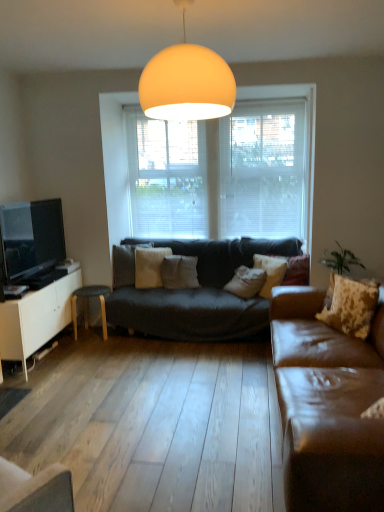
In order to click on matte black tv at left in this screenshot , I will do click(32, 238).

Measure the distance between matte black tv at left and camera.

The depth of matte black tv at left is 3.74 meters.

This screenshot has width=384, height=512. Describe the element at coordinates (36, 318) in the screenshot. I see `white matte cabinet at left` at that location.

In order to face brown leather couch at right, should I rotate leftwards or rightwards?

Turn right approximately 21.064 degrees to face it.

What is the approximate height of brown leather couch at right?

brown leather couch at right is 29.84 inches tall.

What do you see at coordinates (179, 272) in the screenshot? I see `white cotton pillow at center, which is the 3th pillow in right-to-left order` at bounding box center [179, 272].

Locate an element on the screen. This screenshot has width=384, height=512. matte black tv at left is located at coordinates pyautogui.click(x=32, y=238).

Considering the positions of objects white textured pillow at center, placed as the 2th pillow when sorted from front to back, and matte orange globe at upper center in the image provided, who is more to the right, white textured pillow at center, placed as the 2th pillow when sorted from front to back, or matte orange globe at upper center?

Positioned to the right is white textured pillow at center, placed as the 2th pillow when sorted from front to back.

Considering the sizes of white textured pillow at center, the 3th pillow from the back, and matte orange globe at upper center in the image, is white textured pillow at center, the 3th pillow from the back, wider or thinner than matte orange globe at upper center?

Clearly, white textured pillow at center, the 3th pillow from the back, has less width compared to matte orange globe at upper center.

Is white textured pillow at center, placed as the 2th pillow when sorted from front to back, surrounding matte orange globe at upper center?

No.

Is white textured pillow at center, the 3th pillow in the left-to-right sequence, bigger than matte orange globe at upper center?

No.

Does white cotton pillow at center, which is the first pillow in back-to-front order, have a larger size compared to brown leather couch at right?

No, white cotton pillow at center, which is the first pillow in back-to-front order, is not bigger than brown leather couch at right.

In the scene shown: From the image's perspective, is white cotton pillow at center, arranged as the second pillow when viewed from the left, positioned above or below brown leather couch at right?

Clearly, from the image's perspective, white cotton pillow at center, arranged as the second pillow when viewed from the left, is above brown leather couch at right.

From the picture: Is white cotton pillow at center, which is the first pillow in back-to-front order, inside the boundaries of brown leather couch at right, or outside?

white cotton pillow at center, which is the first pillow in back-to-front order, lies outside brown leather couch at right.

Which is more to the left, white cotton pillow at center, which is the first pillow in back-to-front order, or brown leather couch at right?

white cotton pillow at center, which is the first pillow in back-to-front order, is more to the left.

You are a GUI agent. You are given a task and a screenshot of the screen. Output one action in this format:
    pyautogui.click(x=<x>, y=<y>)
    Task: Click on the television located on the left of white soft pillow at center, which appears as the 2th pillow when viewed from the back
    This screenshot has width=384, height=512.
    Given the screenshot: What is the action you would take?
    pyautogui.click(x=32, y=238)

Does point (146, 283) appear closer or farther from the camera than point (56, 216)?

Point (146, 283).

Is white soft pillow at center, which is the fourth pillow from right to left, spatially inside matte black tv at left, or outside of it?

The correct answer is: outside.

Is the depth of fluffy beige pillow at right, which ranks as the 4th pillow in back-to-front order, less than that of white matte window screen at center, the first window screen when ordered from right to left?

Yes.

Considering the positions of objects fluffy beige pillow at right, which appears as the fourth pillow when viewed from the left, and white matte window screen at center, positioned as the second window screen in left-to-right order, in the image provided, who is more to the right, fluffy beige pillow at right, which appears as the fourth pillow when viewed from the left, or white matte window screen at center, positioned as the second window screen in left-to-right order,?

From the viewer's perspective, fluffy beige pillow at right, which appears as the fourth pillow when viewed from the left, appears more on the right side.

Could you tell me if fluffy beige pillow at right, the 1th pillow viewed from the front, is facing white matte window screen at center, positioned as the second window screen in left-to-right order?

No, fluffy beige pillow at right, the 1th pillow viewed from the front, is not facing towards white matte window screen at center, positioned as the second window screen in left-to-right order.

Considering the positions of points (364, 336) and (296, 103), is point (364, 336) closer to camera compared to point (296, 103)?

Yes, it is in front of point (296, 103).

Image resolution: width=384 pixels, height=512 pixels. Identify the location of television lying below the white matte window screen at center, positioned as the second window screen in left-to-right order (from the image's perspective). click(x=32, y=238).

Is matte black tv at left far from white matte window screen at center, positioned as the second window screen in left-to-right order?

matte black tv at left is positioned a significant distance from white matte window screen at center, positioned as the second window screen in left-to-right order.

Is matte black tv at left located outside white matte window screen at center, positioned as the second window screen in left-to-right order?

Yes, matte black tv at left is outside of white matte window screen at center, positioned as the second window screen in left-to-right order.

Looking at their sizes, would you say matte black tv at left is wider or thinner than white matte window screen at center, the first window screen when ordered from right to left?

In the image, matte black tv at left appears to be wider than white matte window screen at center, the first window screen when ordered from right to left.

How far apart are white cotton pillow at center, which is the first pillow in back-to-front order, and matte orange globe at upper center?

white cotton pillow at center, which is the first pillow in back-to-front order, and matte orange globe at upper center are 2.14 meters apart.

Is white cotton pillow at center, arranged as the second pillow when viewed from the left, turned away from matte orange globe at upper center?

No, white cotton pillow at center, arranged as the second pillow when viewed from the left, is not facing the opposite direction of matte orange globe at upper center.

Where is `lamp on the right of the white cotton pillow at center, arranged as the second pillow when viewed from the left`? lamp on the right of the white cotton pillow at center, arranged as the second pillow when viewed from the left is located at coordinates (186, 82).

Choose the correct answer: Is white cotton pillow at center, placed as the 4th pillow when sorted from front to back, inside matte orange globe at upper center or outside it?

white cotton pillow at center, placed as the 4th pillow when sorted from front to back, is not inside matte orange globe at upper center, it's outside.

Based on the photo, measure the distance between white cotton pillow at center, arranged as the second pillow when viewed from the left, and white matte cabinet at left.

A distance of 4.13 feet exists between white cotton pillow at center, arranged as the second pillow when viewed from the left, and white matte cabinet at left.

Is white cotton pillow at center, which is the first pillow in back-to-front order, oriented towards white matte cabinet at left?

No.

Considering the positions of objects white cotton pillow at center, placed as the 4th pillow when sorted from front to back, and white matte cabinet at left in the image provided, who is more to the left, white cotton pillow at center, placed as the 4th pillow when sorted from front to back, or white matte cabinet at left?

white matte cabinet at left.

How different are the orientations of white cotton pillow at center, placed as the 4th pillow when sorted from front to back, and white matte cabinet at left in degrees?

white cotton pillow at center, placed as the 4th pillow when sorted from front to back, and white matte cabinet at left are facing 73.7 degrees away from each other.

Find the location of a particular element. lamp that is above the white textured pillow at center, the 3th pillow in the left-to-right sequence (from a real-world perspective) is located at coordinates (186, 82).

I want to click on studio couch in front of the white cotton pillow at center, arranged as the second pillow when viewed from the left, so click(x=327, y=405).

When comparing their distances from fluffy beige pillow at right, which ranks as the 4th pillow in back-to-front order, does matte orange globe at upper center or white soft pillow at center, which appears as the 2th pillow when viewed from the back, seem further?

Among the two, white soft pillow at center, which appears as the 2th pillow when viewed from the back, is located further to fluffy beige pillow at right, which ranks as the 4th pillow in back-to-front order.

Looking at the image, which one is located further to white blinds at center, the 2th window screen in the right-to-left sequence, matte orange globe at upper center or white textured pillow at center, the 3th pillow in the left-to-right sequence?

matte orange globe at upper center is positioned further to the anchor white blinds at center, the 2th window screen in the right-to-left sequence.

Based on the photo, when comparing their distances from matte black tv at left, does white textured pillow at center, placed as the 2th pillow when sorted from front to back, or fluffy beige pillow at right, which appears as the fourth pillow when viewed from the left, seem further?

Based on the image, fluffy beige pillow at right, which appears as the fourth pillow when viewed from the left, appears to be further to matte black tv at left.

Considering their positions, is white matte window screen at center, the first window screen when ordered from right to left, positioned further to white soft pillow at center, which is the fourth pillow from right to left, than brown leather couch at right?

Based on the image, brown leather couch at right appears to be further to white soft pillow at center, which is the fourth pillow from right to left.

Estimate the real-world distances between objects in this image. Which object is closer to white matte cabinet at left, white blinds at center, the first window screen positioned from the left, or white soft pillow at center, which is the fourth pillow from right to left?

The object closer to white matte cabinet at left is white soft pillow at center, which is the fourth pillow from right to left.

Looking at the image, which one is located further to matte black tv at left, wooden stool at left or white cotton pillow at center, arranged as the second pillow when viewed from the left?

white cotton pillow at center, arranged as the second pillow when viewed from the left, lies further to matte black tv at left than the other object.

Estimate the real-world distances between objects in this image. Which object is further from matte black tv at left, white matte window screen at center, the first window screen when ordered from right to left, or white blinds at center, the first window screen positioned from the left?

The object further to matte black tv at left is white matte window screen at center, the first window screen when ordered from right to left.

When comparing their distances from wooden stool at left, does white textured pillow at center, the 3th pillow from the back, or white matte window screen at center, positioned as the second window screen in left-to-right order, seem further?

The object further to wooden stool at left is white matte window screen at center, positioned as the second window screen in left-to-right order.

Locate an element on the screen. The height and width of the screenshot is (512, 384). cabinetry between brown leather couch at right and white textured pillow at center, the 2th pillow in the right-to-left sequence, from front to back is located at coordinates (36, 318).

Locate an element on the screen. This screenshot has height=512, width=384. television between matte orange globe at upper center and white soft pillow at center, which appears as the 2th pillow when viewed from the back, along the z-axis is located at coordinates (32, 238).

Where is `lamp between brown leather couch at right and white matte window screen at center, the first window screen when ordered from right to left, along the z-axis`? This screenshot has width=384, height=512. lamp between brown leather couch at right and white matte window screen at center, the first window screen when ordered from right to left, along the z-axis is located at coordinates (186, 82).

Where is `cabinetry positioned between brown leather couch at right and white blinds at center, the first window screen positioned from the left, from near to far`? The image size is (384, 512). cabinetry positioned between brown leather couch at right and white blinds at center, the first window screen positioned from the left, from near to far is located at coordinates (36, 318).